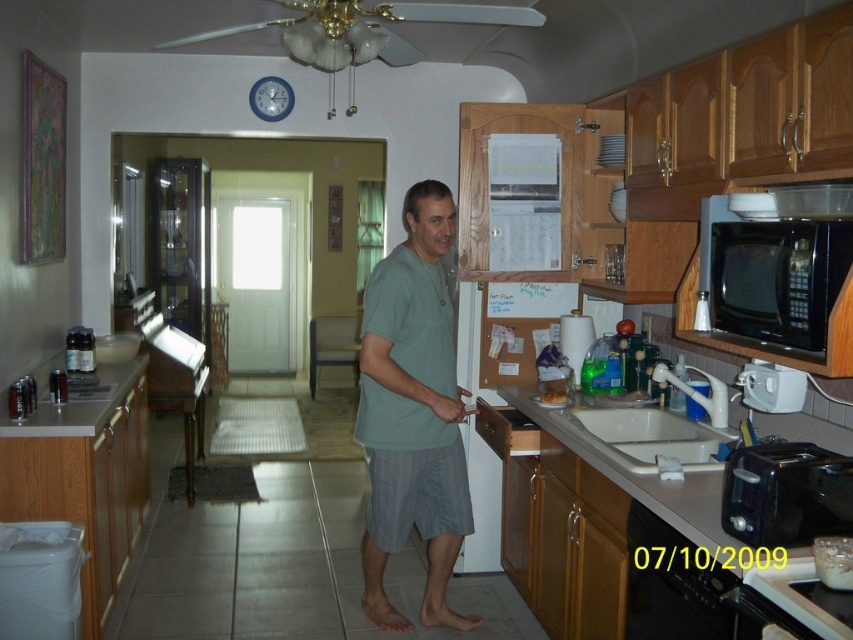
Which is below, gray cotton t-shirt at center or black plastic dishwasher at lower right?

Positioned lower is black plastic dishwasher at lower right.

Is point (387, 392) positioned in front of point (666, 547)?

No, (387, 392) is further to viewer.

Is point (451, 484) positioned in front of point (714, 570)?

No.

Where is `gray cotton t-shirt at center`? gray cotton t-shirt at center is located at coordinates (412, 412).

Which is more to the right, gray cotton t-shirt at center or white plastic exhaust hood at upper center?

Positioned to the right is gray cotton t-shirt at center.

Does gray cotton t-shirt at center have a lesser height compared to white plastic exhaust hood at upper center?

Incorrect, gray cotton t-shirt at center's height does not fall short of white plastic exhaust hood at upper center's.

Does point (434, 506) come farther from viewer compared to point (397, 49)?

Yes.

The image size is (853, 640). In order to click on gray cotton t-shirt at center in this screenshot , I will do `click(412, 412)`.

Is white plastic exhaust hood at upper center shorter than white glossy counter top at lower left?

Incorrect, white plastic exhaust hood at upper center's height does not fall short of white glossy counter top at lower left's.

Who is more distant from viewer, (306, 33) or (142, 364)?

The point (142, 364) is more distant.

The width and height of the screenshot is (853, 640). I want to click on white plastic exhaust hood at upper center, so click(x=364, y=28).